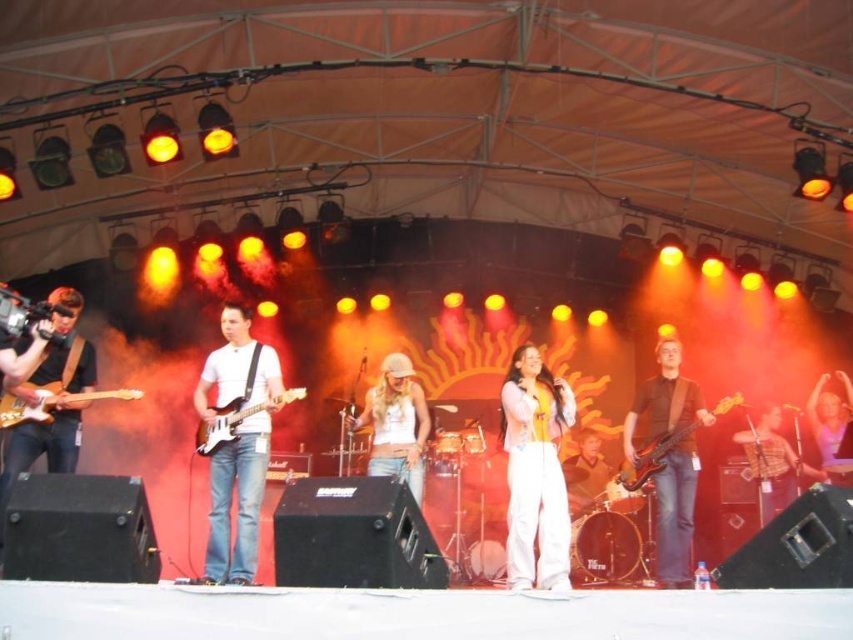
Question: Which object is closer to the camera taking this photo?

Choices:
 (A) white cotton tank top at center
 (B) light brown leather jacket at center

Answer: (A)

Question: Does brown leather guitar at right have a greater width compared to light brown wood electric guitar at left?

Choices:
 (A) yes
 (B) no

Answer: (B)

Question: Is white cotton tank top at center wider than light brown leather jacket at center?

Choices:
 (A) yes
 (B) no

Answer: (A)

Question: Which of the following is the farthest from the observer?

Choices:
 (A) (228, 406)
 (B) (778, 467)

Answer: (B)

Question: Is white cotton tank top at center above pink fabric at center?

Choices:
 (A) no
 (B) yes

Answer: (A)

Question: Which of these objects is positioned farthest from the light brown leather jacket at center?

Choices:
 (A) brown leather guitar at right
 (B) pink fabric at center
 (C) white cotton pants at center
 (D) shiny brown electric guitar at center

Answer: (C)